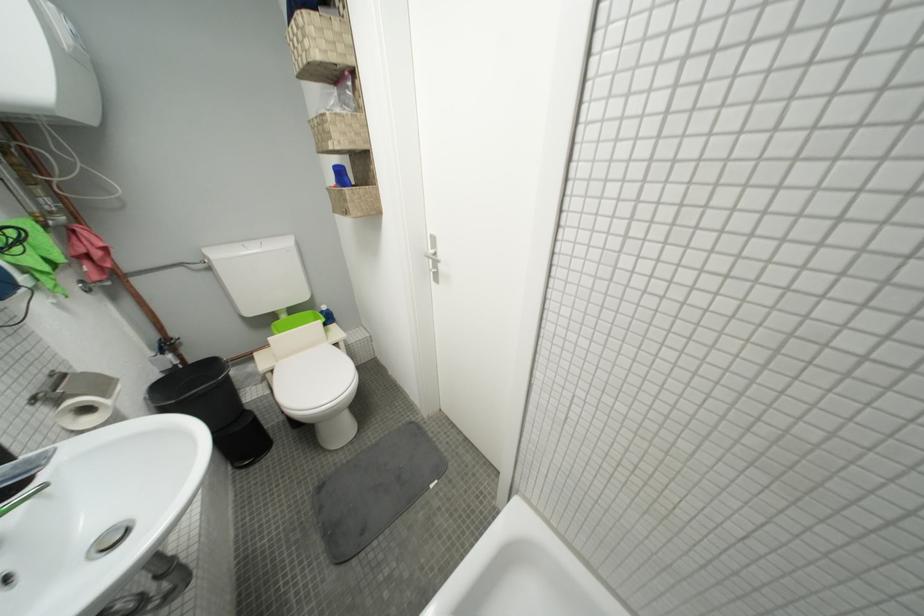
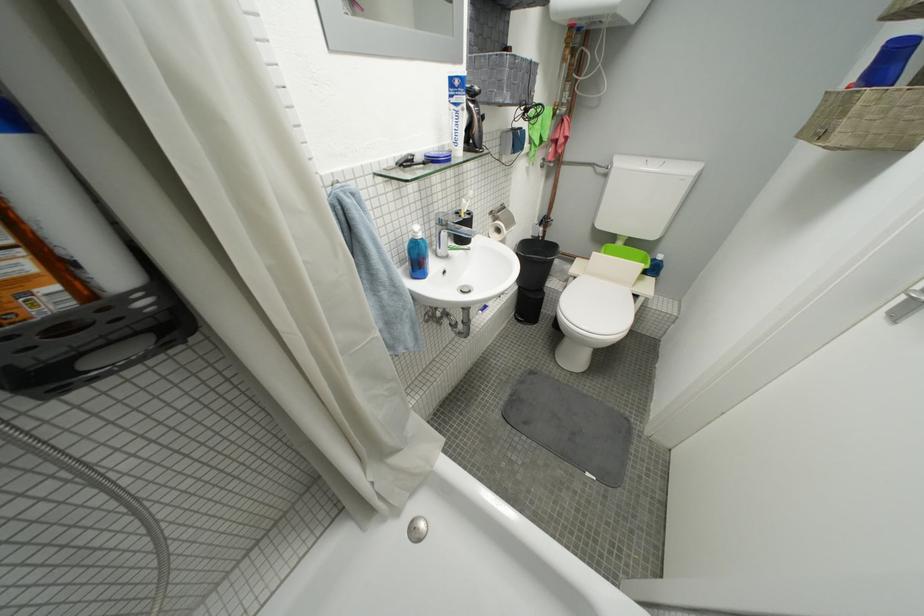
Locate, in the second image, the point that corresponds to point (42, 400) in the first image.

(500, 214)